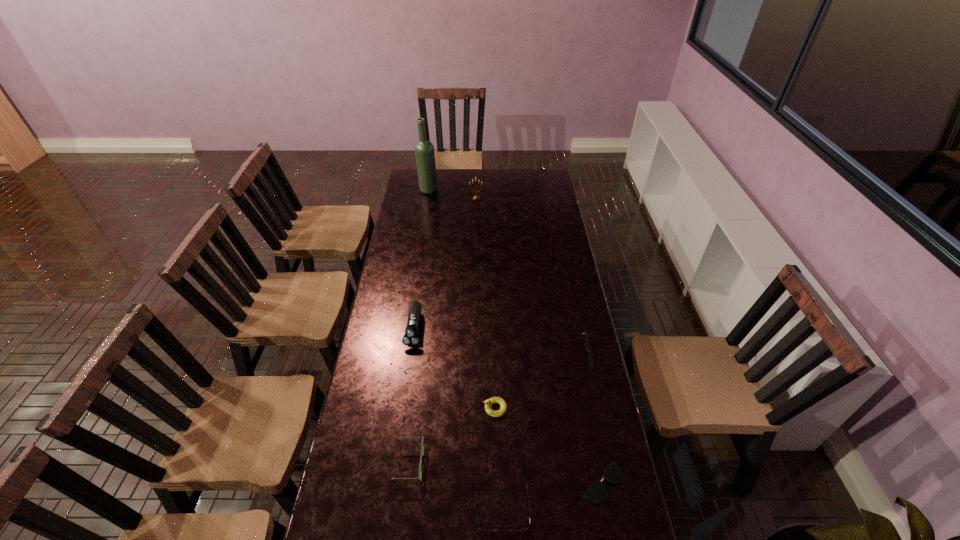
Identify the location of free space between the candelabrum and the second shortest object. (490, 353).

Find the location of a particular element. vacant point located between the farthest spectacles and the candelabrum is located at coordinates (522, 276).

The width and height of the screenshot is (960, 540). I want to click on vacant point located between the second spectacles from left to right and the farthest spectacles, so click(x=535, y=431).

Select which object appears as the fourth closest to the leftmost spectacles. Please provide its 2D coordinates. Your answer should be formatted as a tuple, i.e. [(x, y)], where the tuple contains the x and y coordinates of a point satisfying the conditions above.

[(596, 493)]

Locate which object is the seventh closest to the candelabrum. Please provide its 2D coordinates. Your answer should be formatted as a tuple, i.e. [(x, y)], where the tuple contains the x and y coordinates of a point satisfying the conditions above.

[(487, 528)]

Find the location of a particular element. spectacles that can be found as the second closest to the electric shaver is located at coordinates (587, 349).

Locate which spectacles ranks second in proximity to the leftmost spectacles. Please provide its 2D coordinates. Your answer should be formatted as a tuple, i.e. [(x, y)], where the tuple contains the x and y coordinates of a point satisfying the conditions above.

[(596, 493)]

The height and width of the screenshot is (540, 960). I want to click on free location that satisfies the following two spatial constraints: 1. on the lens of the leftmost spectacles; 2. on the back side of the shortest object, so click(x=407, y=482).